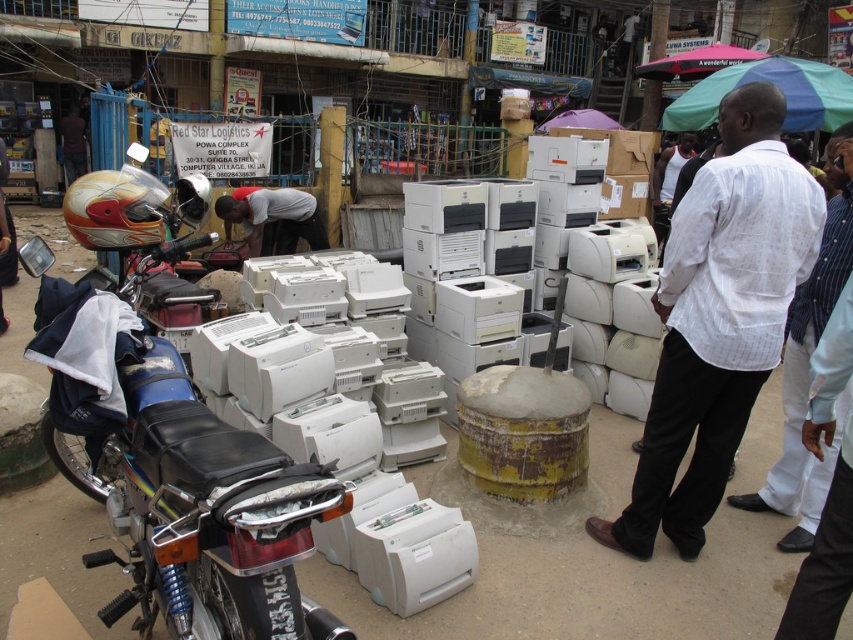
You are a fashion designer observing two shirts in the scene. The white cotton shirt at center and the white striped shirt at center. Which one is taller?

The white cotton shirt at center is much taller than the white striped shirt at center.

You are a photographer standing in the middle of the street. You want to take a photo of the shiny chrome motorcycle at left and the white striped shirt at center. Which object will appear larger in your photo?

The shiny chrome motorcycle at left will appear larger in the photo because it is closer to the viewer than the white striped shirt at center.